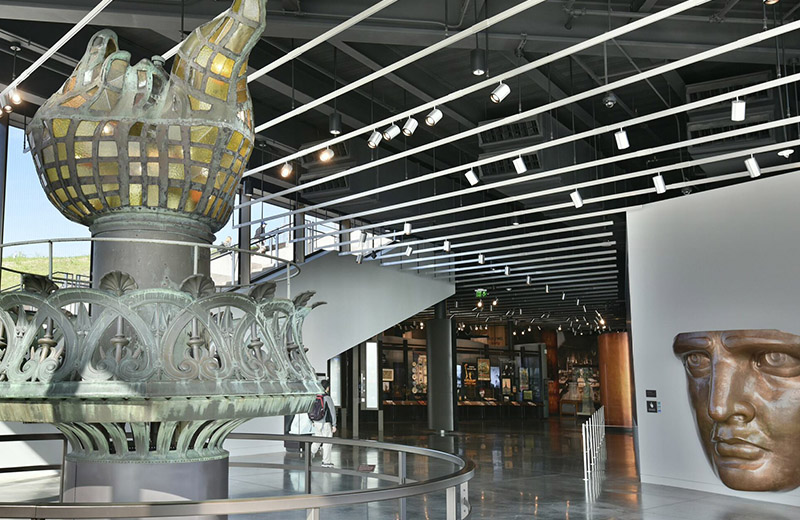
What are the coordinates of `marble floor` in the screenshot? It's located at (521, 456).